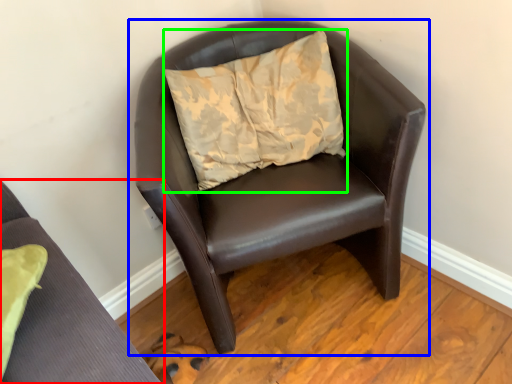
Question: Based on their relative distances, which object is nearer to chair (highlighted by a red box)? Choose from chair (highlighted by a blue box) and pillow (highlighted by a green box).

Choices:
 (A) chair
 (B) pillow

Answer: (A)